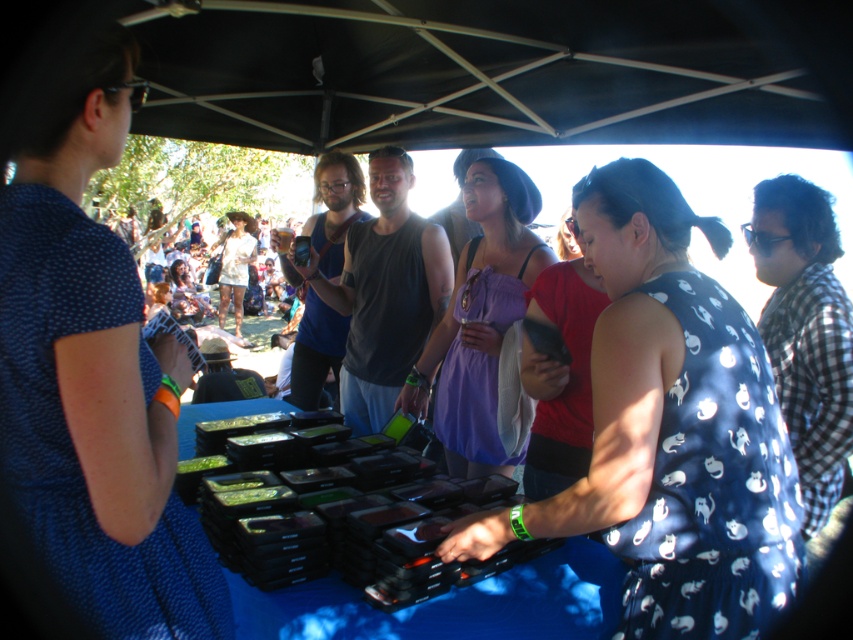
Question: Which is farther from the matte white dress at center?

Choices:
 (A) blue dotted dress at center
 (B) purple satin dress at center
 (C) blue dotted dress at left

Answer: (C)

Question: Can you confirm if blue dotted dress at left is bigger than purple satin dress at center?

Choices:
 (A) yes
 (B) no

Answer: (B)

Question: Is blue dotted dress at left bigger than matte white dress at center?

Choices:
 (A) no
 (B) yes

Answer: (A)

Question: Does blue dotted dress at left appear under purple satin dress at center?

Choices:
 (A) no
 (B) yes

Answer: (B)

Question: Which object is the farthest from the matte white dress at center?

Choices:
 (A) purple satin dress at center
 (B) blue dotted dress at left
 (C) blue dotted dress at center

Answer: (B)

Question: Which object is farther from the camera taking this photo?

Choices:
 (A) blue dotted dress at left
 (B) purple satin dress at center
 (C) blue dotted dress at center

Answer: (B)